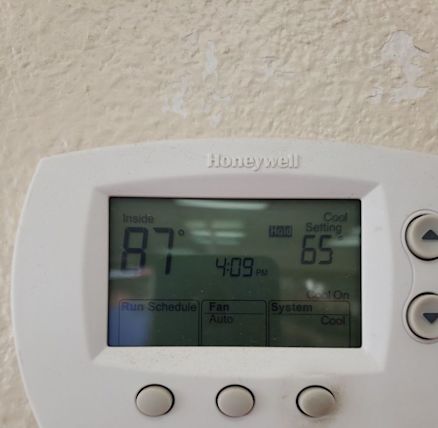
Where is `led panel`? Image resolution: width=438 pixels, height=428 pixels. led panel is located at coordinates (200, 262).